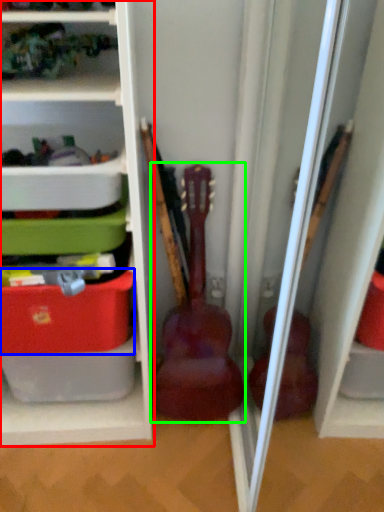
Question: Based on their relative distances, which object is farther from shelf (highlighted by a red box)? Choose from storage box (highlighted by a blue box) and guitar (highlighted by a green box).

Choices:
 (A) storage box
 (B) guitar

Answer: (B)